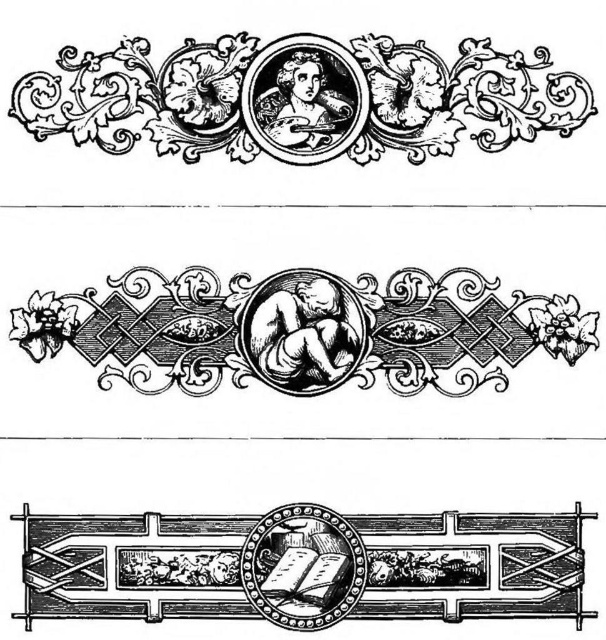
Question: Which object is farther from the camera taking this photo?

Choices:
 (A) wooden carved frame at bottom center
 (B) black ink cherub at center
 (C) etched wood portrait at upper center

Answer: (C)

Question: Considering the real-world distances, which object is closest to the etched wood portrait at upper center?

Choices:
 (A) black ink cherub at center
 (B) wooden carved frame at bottom center

Answer: (A)

Question: Is the position of etched wood portrait at upper center less distant than that of black ink cherub at center?

Choices:
 (A) yes
 (B) no

Answer: (B)

Question: Considering the real-world distances, which object is farthest from the wooden carved frame at bottom center?

Choices:
 (A) etched wood portrait at upper center
 (B) black ink cherub at center

Answer: (A)

Question: Considering the relative positions of etched wood portrait at upper center and wooden carved frame at bottom center in the image provided, where is etched wood portrait at upper center located with respect to wooden carved frame at bottom center?

Choices:
 (A) left
 (B) right

Answer: (A)

Question: Can you confirm if etched wood portrait at upper center is positioned to the left of black ink cherub at center?

Choices:
 (A) no
 (B) yes

Answer: (B)